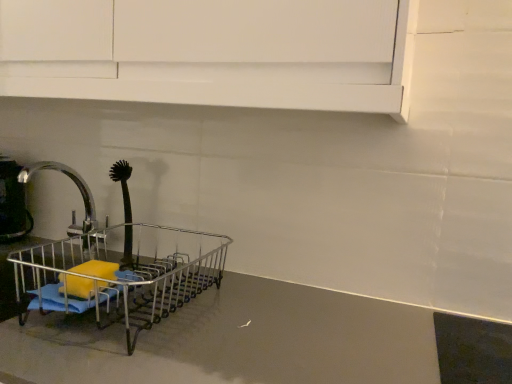
Image resolution: width=512 pixels, height=384 pixels. I want to click on vacant space that is to the left of black rubber brush at left, so click(x=50, y=251).